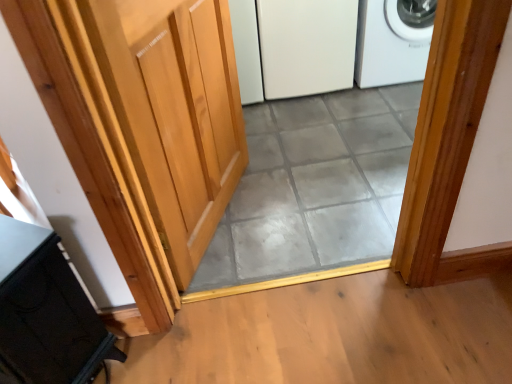
This screenshot has width=512, height=384. Find the location of `vacant area that is in front of light wood door at center`. vacant area that is in front of light wood door at center is located at coordinates tap(247, 292).